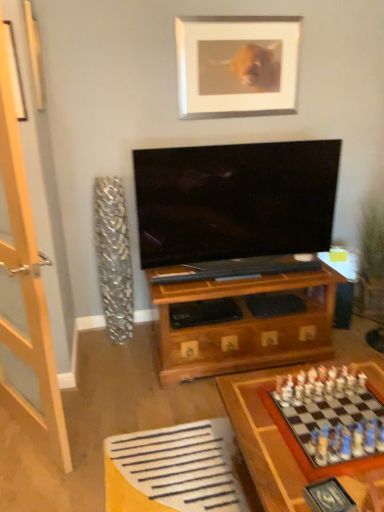
Question: Is clear glass door at left aimed at wooden chessboard at lower right?

Choices:
 (A) yes
 (B) no

Answer: (B)

Question: Is clear glass door at left next to wooden chessboard at lower right and touching it?

Choices:
 (A) no
 (B) yes

Answer: (A)

Question: Is clear glass door at left not within wooden chessboard at lower right?

Choices:
 (A) no
 (B) yes

Answer: (B)

Question: Is clear glass door at left at the left side of wooden chessboard at lower right?

Choices:
 (A) no
 (B) yes

Answer: (B)

Question: Could wooden chessboard at lower right be considered to be inside clear glass door at left?

Choices:
 (A) yes
 (B) no

Answer: (B)

Question: Is wooden chess set at lower right to the left or to the right of silver metallic picture frame at upper center in the image?

Choices:
 (A) right
 (B) left

Answer: (A)

Question: From a real-world perspective, is wooden chess set at lower right physically located above or below silver metallic picture frame at upper center?

Choices:
 (A) above
 (B) below

Answer: (B)

Question: Is wooden chess set at lower right wider or thinner than silver metallic picture frame at upper center?

Choices:
 (A) thin
 (B) wide

Answer: (B)

Question: From the image's perspective, is wooden chess set at lower right above or below silver metallic picture frame at upper center?

Choices:
 (A) above
 (B) below

Answer: (B)

Question: From a real-world perspective, is wooden chessboard at lower right physically located above or below wooden chess set at lower right?

Choices:
 (A) above
 (B) below

Answer: (B)

Question: Considering the positions of wooden chessboard at lower right and wooden chess set at lower right in the image, is wooden chessboard at lower right taller or shorter than wooden chess set at lower right?

Choices:
 (A) tall
 (B) short

Answer: (A)

Question: Which is correct: wooden chessboard at lower right is inside wooden chess set at lower right, or outside of it?

Choices:
 (A) outside
 (B) inside

Answer: (A)

Question: Considering the positions of point (220, 389) and point (354, 463), is point (220, 389) closer or farther from the camera than point (354, 463)?

Choices:
 (A) farther
 (B) closer

Answer: (A)

Question: Is point (342, 384) positioned closer to the camera than point (238, 408)?

Choices:
 (A) closer
 (B) farther

Answer: (B)

Question: From a real-world perspective, is wooden chess set at lower right physically located above or below wooden chessboard at lower right?

Choices:
 (A) above
 (B) below

Answer: (A)